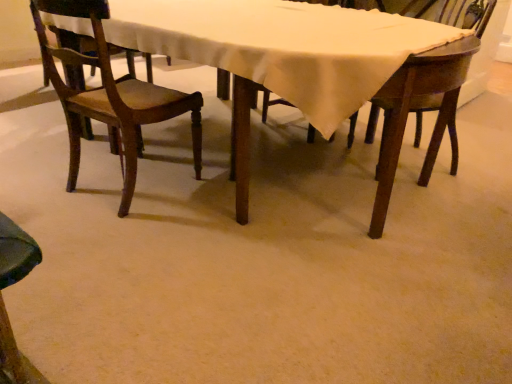
The width and height of the screenshot is (512, 384). In order to click on blank space to the left of wooden chair at upper right, placed as the first chair when sorted from right to left in this screenshot , I will do `click(340, 163)`.